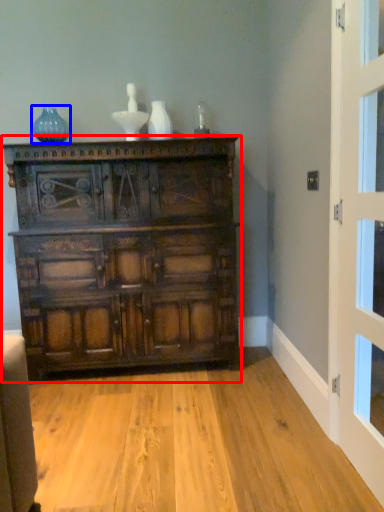
Question: Among these objects, which one is farthest to the camera, chest of drawers (highlighted by a red box) or vase (highlighted by a blue box)?

Choices:
 (A) chest of drawers
 (B) vase

Answer: (B)